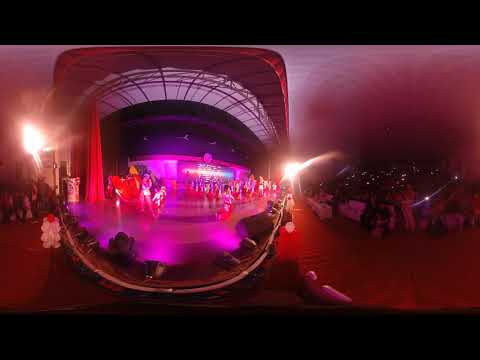
Locate an element on the screen. The image size is (480, 360). wall is located at coordinates tap(20, 62).